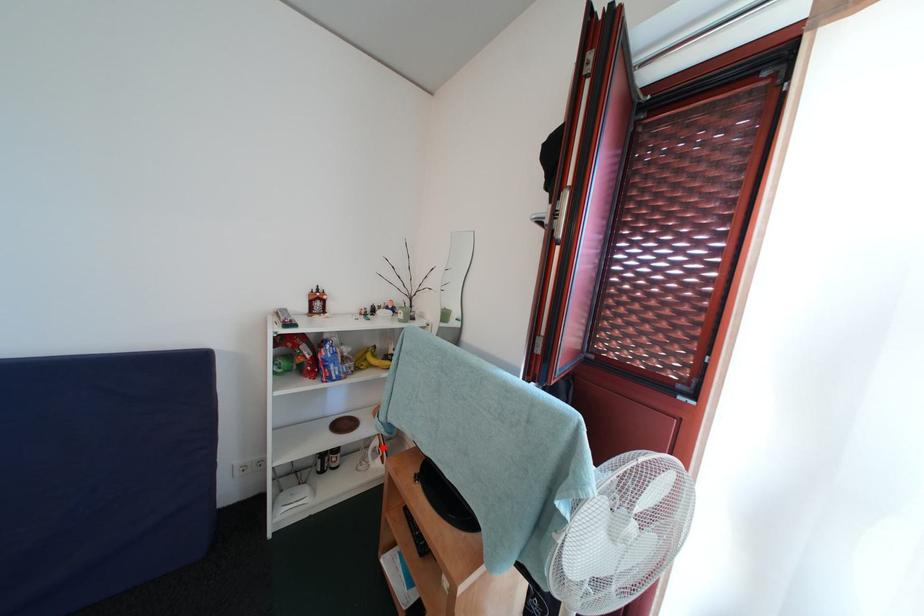
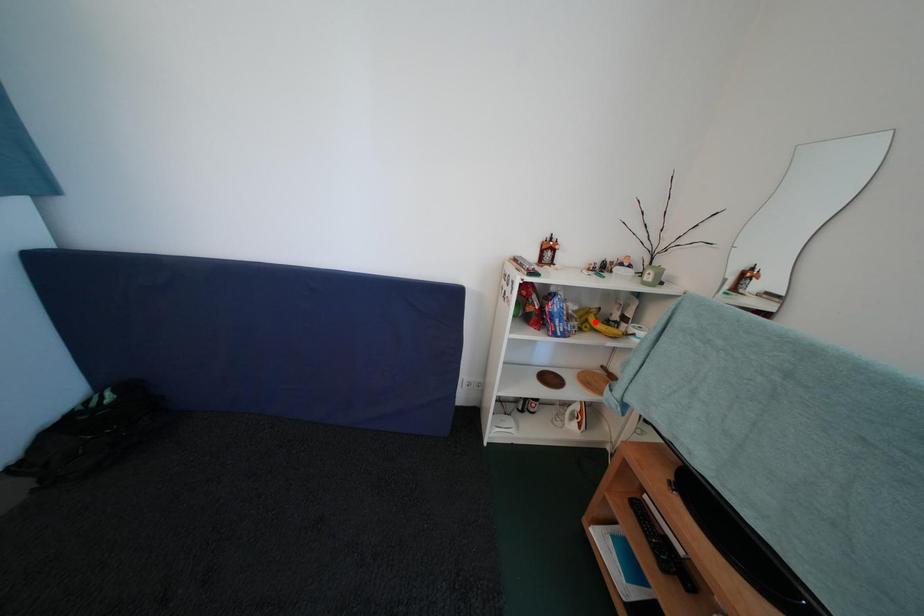
I am providing you with two images of the same scene from different viewpoints. A red point is marked on the first image and another point is marked on the second image. Do the highlighted points in image1 and image2 indicate the same real-world spot?

No